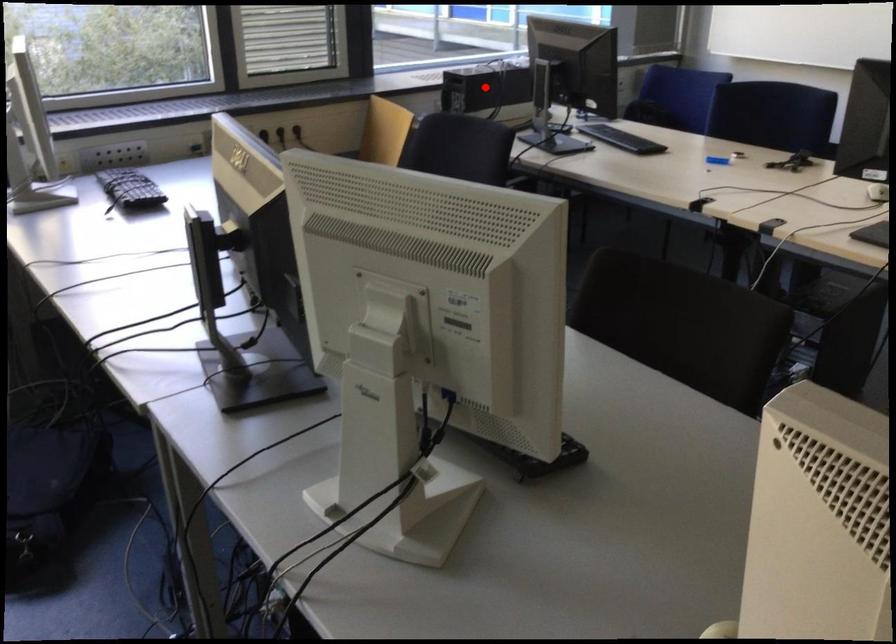
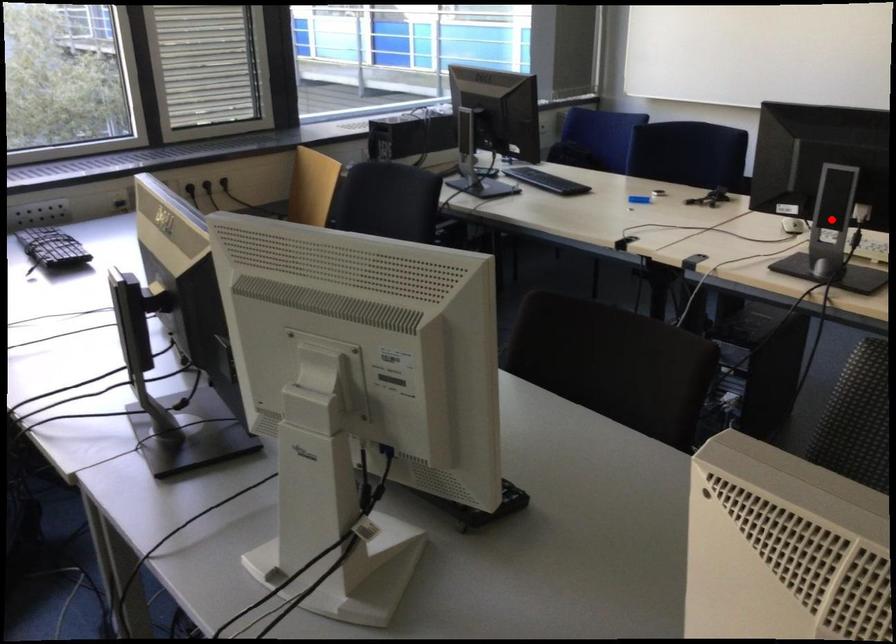
I am providing you with two images of the same scene from different viewpoints. A red point is marked on the first image and another point is marked on the second image. Is the marked point in image1 the same physical position as the marked point in image2?

No